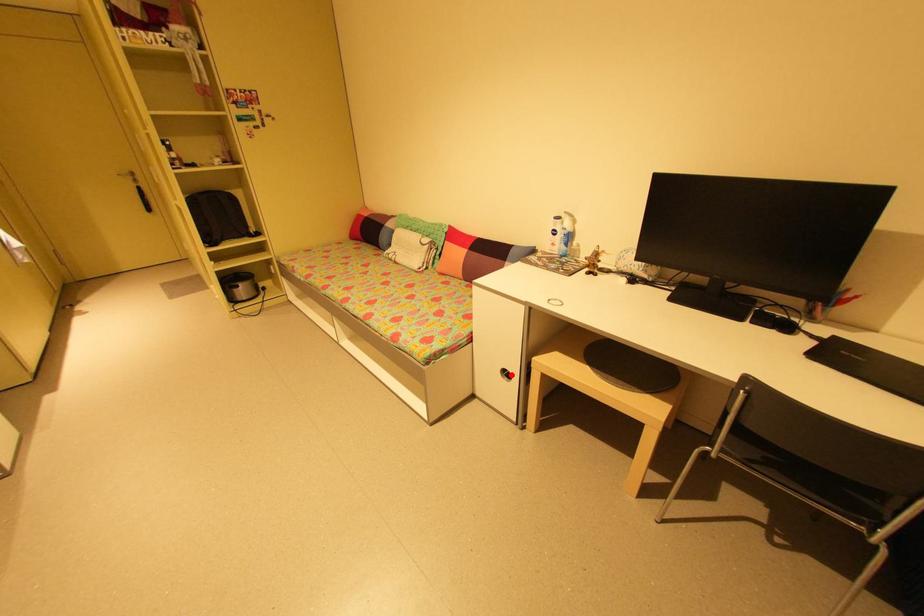
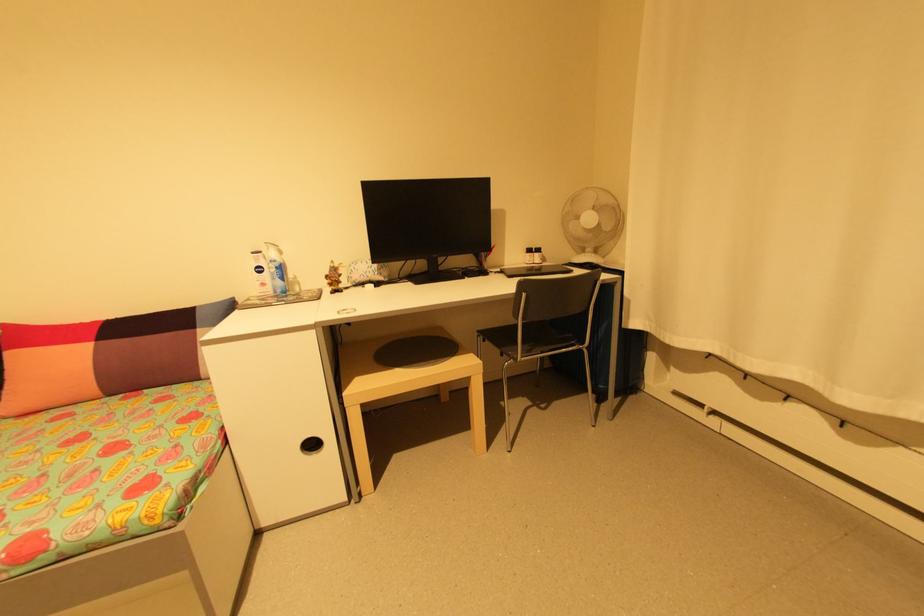
Locate, in the second image, the point that corresponds to the highlighted location in the first image.

(317, 446)